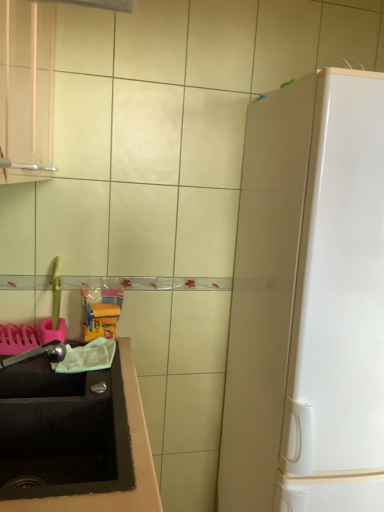
The height and width of the screenshot is (512, 384). I want to click on black matte sink at lower left, so click(x=64, y=431).

Measure the distance between satin nickel faucet at lower left and camera.

satin nickel faucet at lower left is 1.30 meters away from camera.

At what (x,y) coordinates should I click in order to perform the action: click on black matte sink at lower left. Please return your answer as a coordinate pair (x, y). Looking at the image, I should click on (64, 431).

Looking at this image, from a real-world perspective, is white glossy refrigerator at right physically located above or below black matte sink at lower left?

In terms of real-world spatial position, white glossy refrigerator at right is above black matte sink at lower left.

From the image's perspective, is white glossy refrigerator at right above or below black matte sink at lower left?

Based on their image positions, white glossy refrigerator at right is located above black matte sink at lower left.

From the picture: Between white glossy refrigerator at right and black matte sink at lower left, which one has larger width?

white glossy refrigerator at right is wider.

Is white glossy refrigerator at right beside black matte sink at lower left?

No, white glossy refrigerator at right is not next to black matte sink at lower left.

Which of these two, black matte sink at lower left or satin nickel faucet at lower left, is smaller?

With smaller size is satin nickel faucet at lower left.

Considering the sizes of black matte sink at lower left and satin nickel faucet at lower left in the image, is black matte sink at lower left taller or shorter than satin nickel faucet at lower left?

Clearly, black matte sink at lower left is taller compared to satin nickel faucet at lower left.

Which of these two, black matte sink at lower left or satin nickel faucet at lower left, is thinner?

satin nickel faucet at lower left.

Is black matte sink at lower left not within satin nickel faucet at lower left?

black matte sink at lower left lies outside satin nickel faucet at lower left's area.

From the image's perspective, relative to satin nickel faucet at lower left, is white glossy refrigerator at right above or below?

white glossy refrigerator at right is situated lower than satin nickel faucet at lower left in the image.

In terms of width, does white glossy refrigerator at right look wider or thinner when compared to satin nickel faucet at lower left?

white glossy refrigerator at right is wider than satin nickel faucet at lower left.

Identify the location of appliance in front of the satin nickel faucet at lower left. (308, 302).

Is white glossy refrigerator at right touching satin nickel faucet at lower left?

They are not placed beside each other.

Does point (123, 465) come behind point (295, 215)?

That is False.

Would you say black matte sink at lower left is outside white glossy refrigerator at right?

Yes, black matte sink at lower left is not within white glossy refrigerator at right.

Considering the relative positions of black matte sink at lower left and white glossy refrigerator at right in the image provided, is black matte sink at lower left to the right of white glossy refrigerator at right from the viewer's perspective?

Incorrect, black matte sink at lower left is not on the right side of white glossy refrigerator at right.

From the image's perspective, which object appears higher, black matte sink at lower left or white glossy refrigerator at right?

white glossy refrigerator at right, from the image's perspective.

Can you confirm if satin nickel faucet at lower left is positioned to the right of black matte sink at lower left?

Incorrect, satin nickel faucet at lower left is not on the right side of black matte sink at lower left.

Looking at this image, measure the distance between satin nickel faucet at lower left and black matte sink at lower left.

satin nickel faucet at lower left is 23.61 centimeters from black matte sink at lower left.

Between satin nickel faucet at lower left and black matte sink at lower left, which one has larger size?

Bigger between the two is black matte sink at lower left.

The width and height of the screenshot is (384, 512). What are the coordinates of `sink below the satin nickel faucet at lower left (from a real-world perspective)` in the screenshot? It's located at (64, 431).

How much distance is there between satin nickel faucet at lower left and white glossy refrigerator at right?

They are 32.35 inches apart.

Could you tell me if satin nickel faucet at lower left is facing white glossy refrigerator at right?

Yes, satin nickel faucet at lower left is facing white glossy refrigerator at right.

From a real-world perspective, is satin nickel faucet at lower left on top of white glossy refrigerator at right?

Yes, from a real-world perspective, satin nickel faucet at lower left is on top of white glossy refrigerator at right.

Does satin nickel faucet at lower left lie behind white glossy refrigerator at right?

Yes, satin nickel faucet at lower left is further from the viewer.

This screenshot has width=384, height=512. Find the location of `sink below the white glossy refrigerator at right (from the image's perspective)`. sink below the white glossy refrigerator at right (from the image's perspective) is located at coordinates (64, 431).

The width and height of the screenshot is (384, 512). I want to click on sink on the right of satin nickel faucet at lower left, so click(64, 431).

Which object lies further to the anchor point satin nickel faucet at lower left, black matte sink at lower left or white glossy refrigerator at right?

Based on the image, white glossy refrigerator at right appears to be further to satin nickel faucet at lower left.

Considering their positions, is black matte sink at lower left positioned further to white glossy refrigerator at right than satin nickel faucet at lower left?

satin nickel faucet at lower left lies further to white glossy refrigerator at right than the other object.

Considering their positions, is white glossy refrigerator at right positioned further to satin nickel faucet at lower left than black matte sink at lower left?

white glossy refrigerator at right lies further to satin nickel faucet at lower left than the other object.

Considering their positions, is satin nickel faucet at lower left positioned further to white glossy refrigerator at right than black matte sink at lower left?

Based on the image, satin nickel faucet at lower left appears to be further to white glossy refrigerator at right.

Looking at the image, which one is located closer to black matte sink at lower left, satin nickel faucet at lower left or white glossy refrigerator at right?

satin nickel faucet at lower left is closer to black matte sink at lower left.

Considering their positions, is white glossy refrigerator at right positioned closer to black matte sink at lower left than satin nickel faucet at lower left?

The object closer to black matte sink at lower left is satin nickel faucet at lower left.

Find the location of a particular element. sink between satin nickel faucet at lower left and white glossy refrigerator at right in the horizontal direction is located at coordinates tap(64, 431).